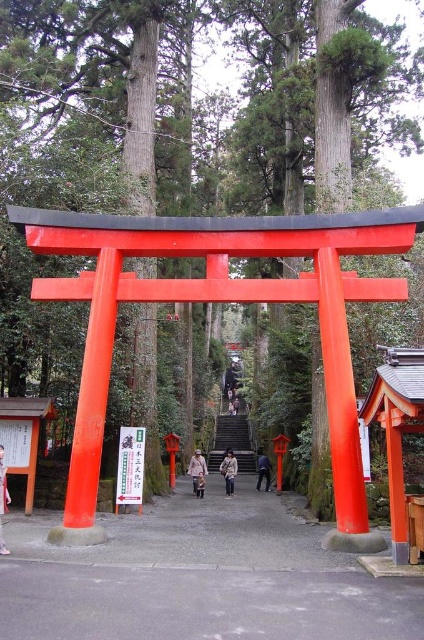
Question: Which object is the farthest from the pink fabric coat at center?

Choices:
 (A) blue denim jeans at center
 (B) light brown leather coat at center
 (C) light brown leather jacket at lower left
 (D) beige fabric coat at center

Answer: (C)

Question: In this image, where is light brown leather jacket at lower left located relative to light brown leather coat at center?

Choices:
 (A) left
 (B) right

Answer: (A)

Question: Does pink fabric coat at center have a greater width compared to light brown leather coat at center?

Choices:
 (A) no
 (B) yes

Answer: (B)

Question: Which of the following is the farthest from the observer?

Choices:
 (A) blue denim jeans at center
 (B) beige fabric coat at center
 (C) light brown leather jacket at lower left
 (D) light brown leather coat at center

Answer: (A)

Question: Can you confirm if pink fabric coat at center is thinner than beige fabric coat at center?

Choices:
 (A) yes
 (B) no

Answer: (B)

Question: Among these points, which one is farthest from the camera?

Choices:
 (A) (222, 465)
 (B) (267, 465)

Answer: (B)